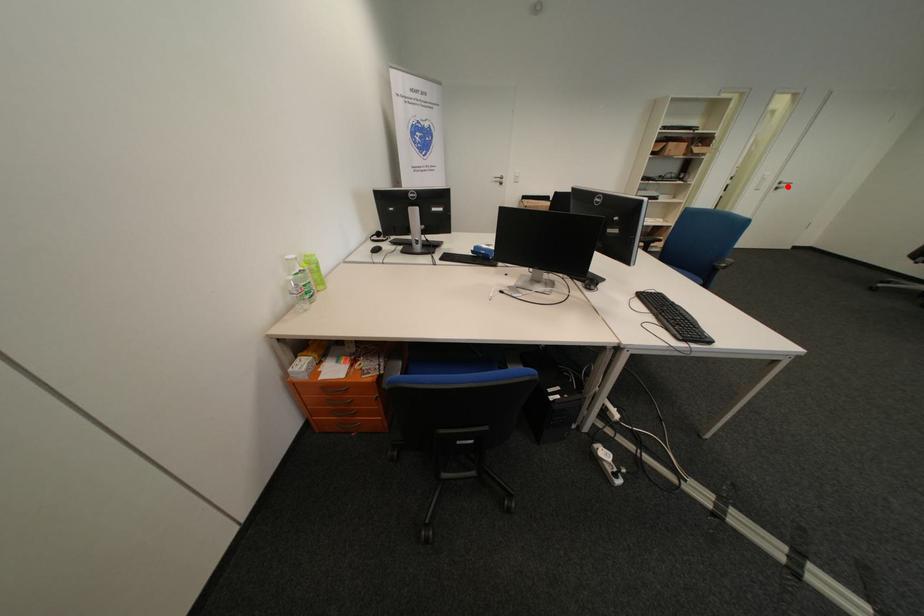
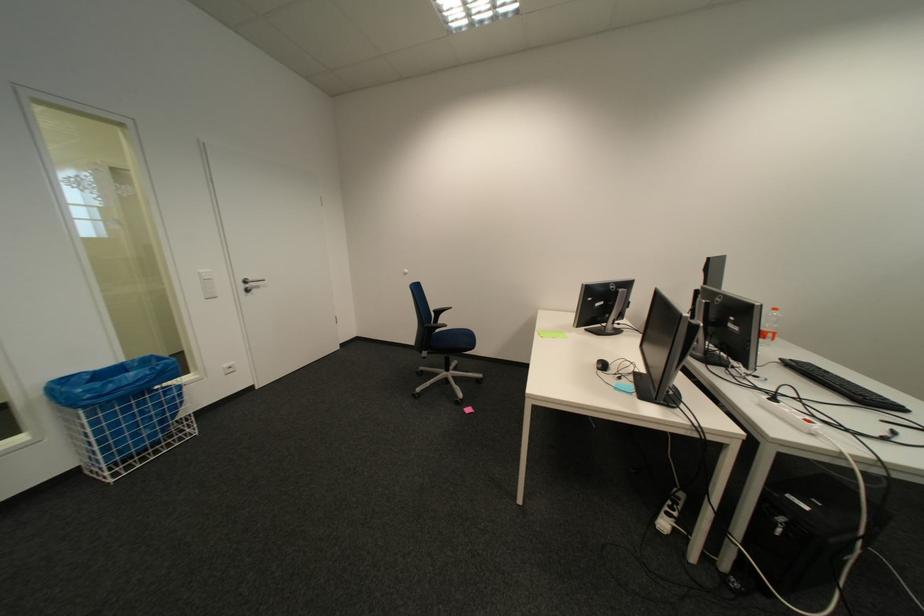
Find the pixel in the second image that matches the highlighted location in the first image.

(254, 286)